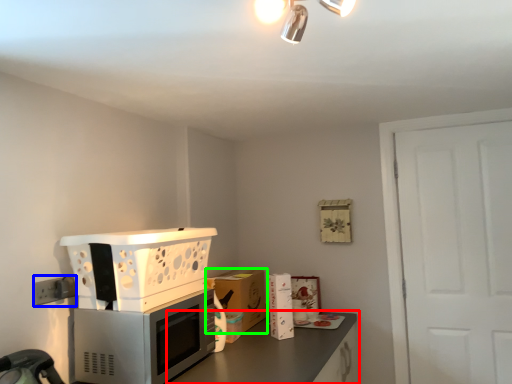
Question: Which object is the closest to the countertop (highlighted by a red box)? Choose among these: electric outlet (highlighted by a blue box) or cabinetry (highlighted by a green box).

Choices:
 (A) electric outlet
 (B) cabinetry

Answer: (B)